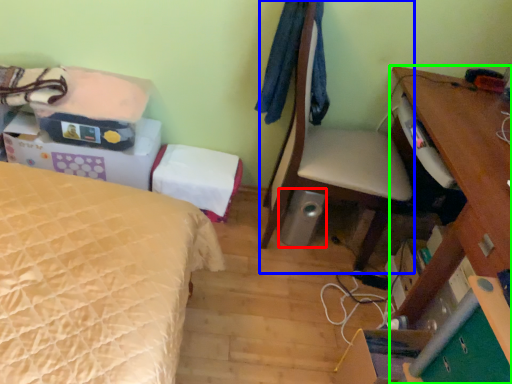
Question: Based on their relative distances, which object is nearer to loudspeaker (highlighted by a red box)? Choose from chair (highlighted by a blue box) and desk (highlighted by a green box).

Choices:
 (A) chair
 (B) desk

Answer: (A)